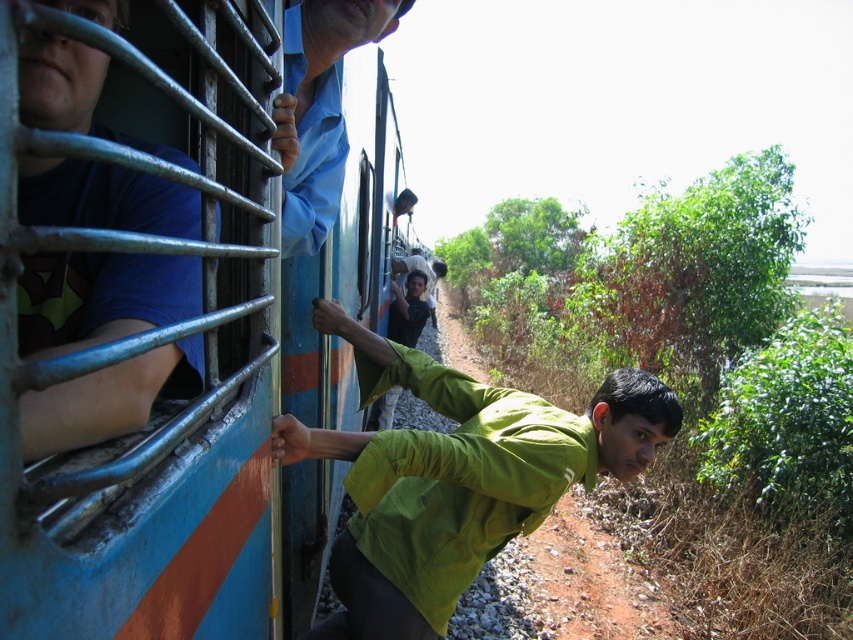
Is blue painted metal train at left closer to camera compared to green matte shirt at center?

That is True.

Which is more to the left, blue painted metal train at left or green matte shirt at center?

From the viewer's perspective, blue painted metal train at left appears more on the left side.

Where is `blue painted metal train at left`? This screenshot has height=640, width=853. blue painted metal train at left is located at coordinates (149, 307).

Based on the photo, can you confirm if blue painted metal train at left is smaller than matte green shirt at center?

Incorrect, blue painted metal train at left is not smaller in size than matte green shirt at center.

Is point (202, 592) positioned in front of point (405, 340)?

Yes, it is.

The height and width of the screenshot is (640, 853). Identify the location of blue painted metal train at left. (149, 307).

Is point (28, 426) positioned behind point (397, 285)?

No, (28, 426) is closer to viewer.

Between point (74, 188) and point (396, 337), which one is positioned in front?

Point (74, 188) is more forward.

Locate an element on the screen. The image size is (853, 640). blue fabric shirt at left is located at coordinates (100, 298).